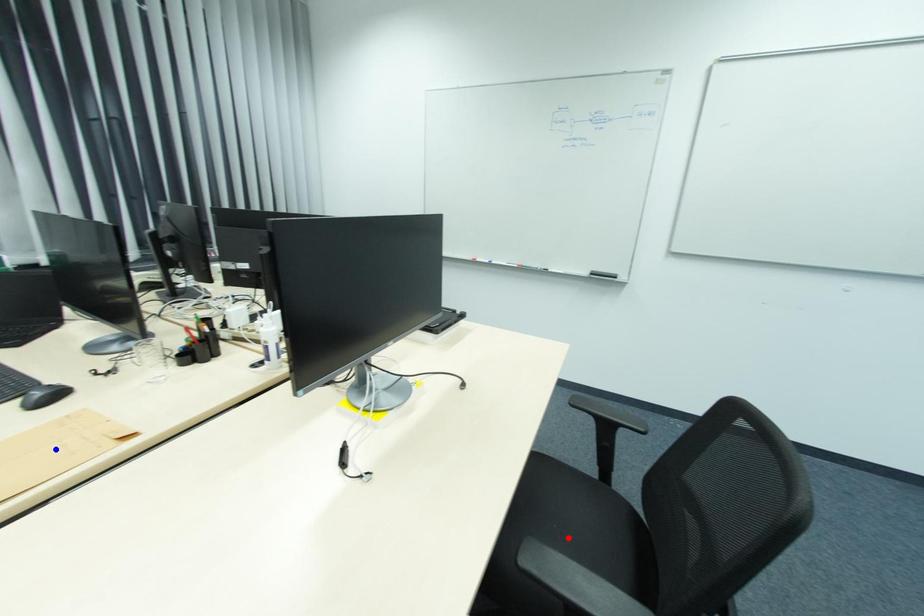
Question: Two points are marked on the image. Which point is closer to the camera?

Choices:
 (A) Blue point is closer.
 (B) Red point is closer.

Answer: (A)